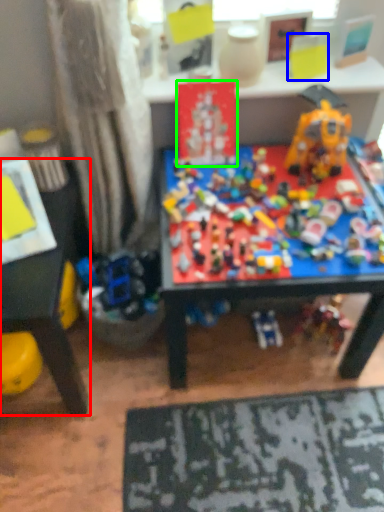
Question: Which object is the closest to the table (highlighted by a red box)? Choose among these: toy (highlighted by a blue box) or toy (highlighted by a green box).

Choices:
 (A) toy
 (B) toy

Answer: (B)